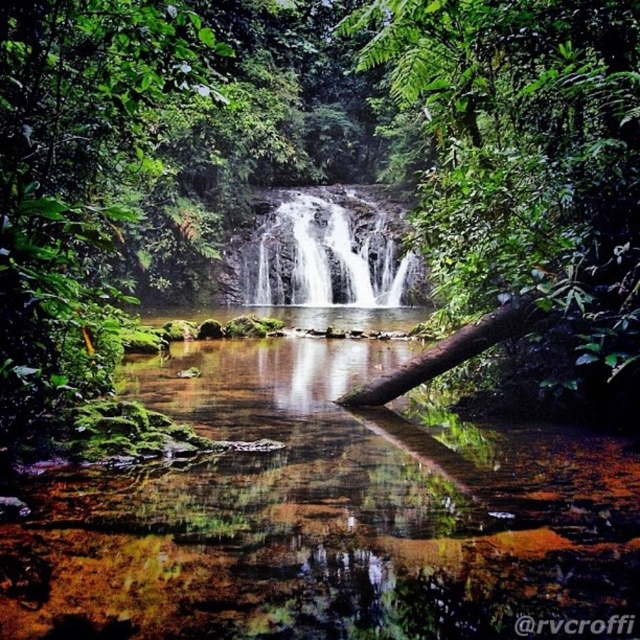
Question: Where is green rough log at center located in relation to brown rough log at center in the image?

Choices:
 (A) right
 (B) left

Answer: (A)

Question: Can you confirm if green rough log at center is positioned to the left of brown rough log at center?

Choices:
 (A) no
 (B) yes

Answer: (A)

Question: Which point is farther from the camera taking this photo?

Choices:
 (A) (74, 310)
 (B) (468, 216)
 (C) (276, 230)
 (D) (413, 371)

Answer: (C)

Question: Does white smooth waterfall at center appear under brown rough log at center?

Choices:
 (A) yes
 (B) no

Answer: (B)

Question: Among these points, which one is nearest to the camera?

Choices:
 (A) (596, 148)
 (B) (381, 403)

Answer: (A)

Question: Which of the following is the closest to the observer?

Choices:
 (A) green leafy tree at center
 (B) brown rough log at center
 (C) green rough log at center
 (D) white smooth waterfall at center

Answer: (A)